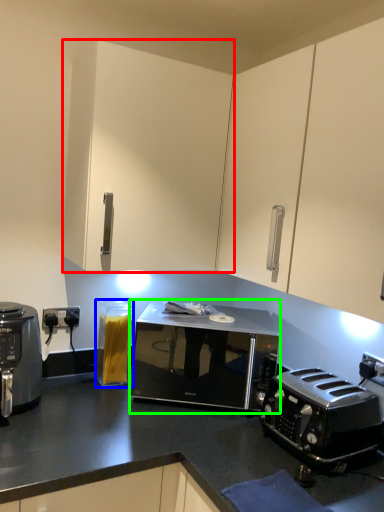
Question: Which is nearer to the cabinetry (highlighted by a red box)? appliance (highlighted by a blue box) or microwave oven (highlighted by a green box).

Choices:
 (A) appliance
 (B) microwave oven

Answer: (B)